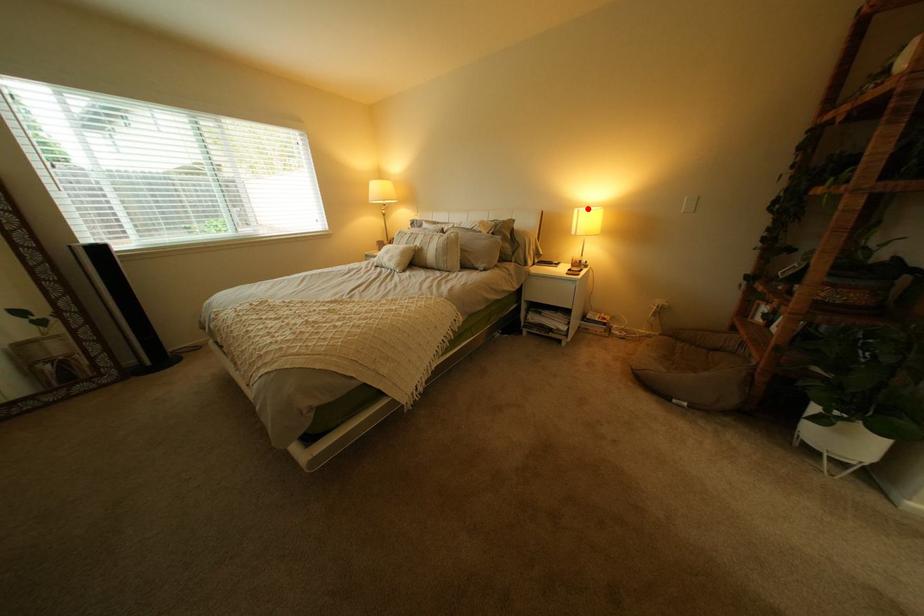
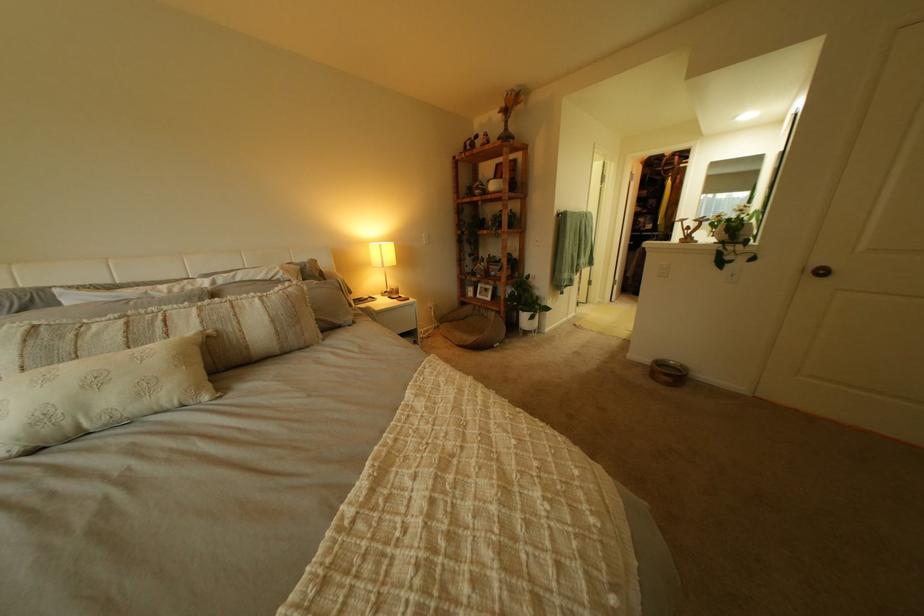
In the second image, find the point that corresponds to the highlighted location in the first image.

(381, 244)